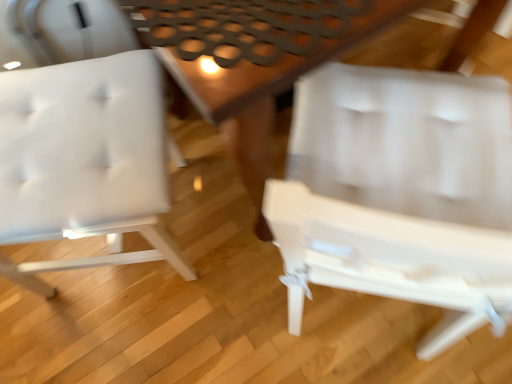
Question: Is wooden table at center inside or outside of white plastic chair at center, placed as the second chair when sorted from left to right?

Choices:
 (A) inside
 (B) outside

Answer: (B)

Question: In the image, is wooden table at center positioned in front of or behind white plastic chair at center, arranged as the first chair when viewed from the right?

Choices:
 (A) front
 (B) behind

Answer: (B)

Question: Which object is positioned farthest from the white matte chair at left, which appears as the 2th chair when viewed from the right?

Choices:
 (A) white plastic chair at center, placed as the second chair when sorted from left to right
 (B) wooden table at center

Answer: (A)

Question: Which is farther from the white plastic chair at center, arranged as the first chair when viewed from the right?

Choices:
 (A) white matte chair at left, which appears as the 2th chair when viewed from the right
 (B) wooden table at center

Answer: (A)